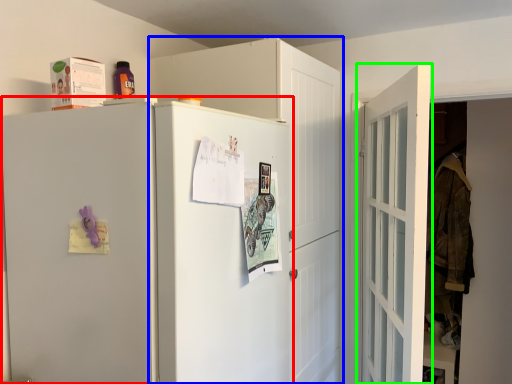
Question: Which object is the farthest from refrigerator (highlighted by a red box)? Choose among these: cabinetry (highlighted by a blue box) or door (highlighted by a green box).

Choices:
 (A) cabinetry
 (B) door

Answer: (B)